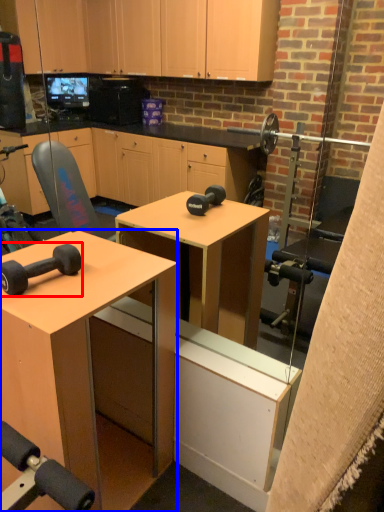
Question: Among these objects, which one is farthest to the camera, dumbbell (highlighted by a red box) or desk (highlighted by a blue box)?

Choices:
 (A) dumbbell
 (B) desk

Answer: (A)